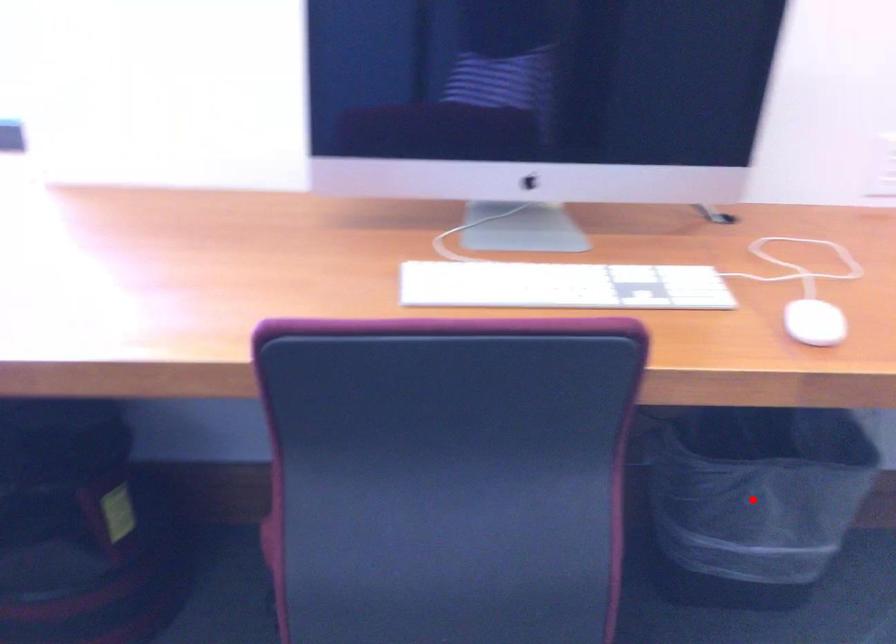
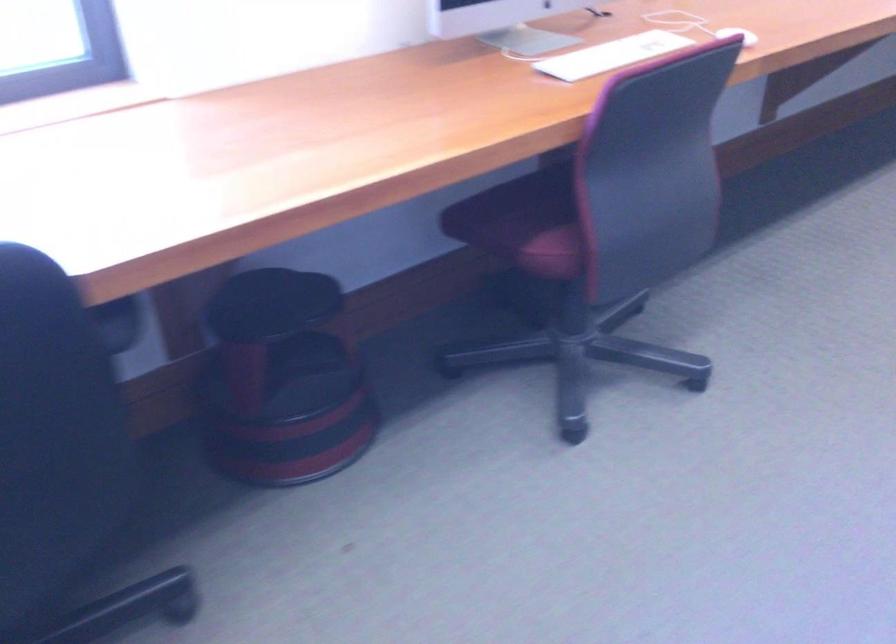
Question: I am providing you with two images of the same scene from different viewpoints. A red point is marked on the first image. At the location where the point appears in image 1, is it still visible in image 2?

Choices:
 (A) Yes
 (B) No

Answer: (B)